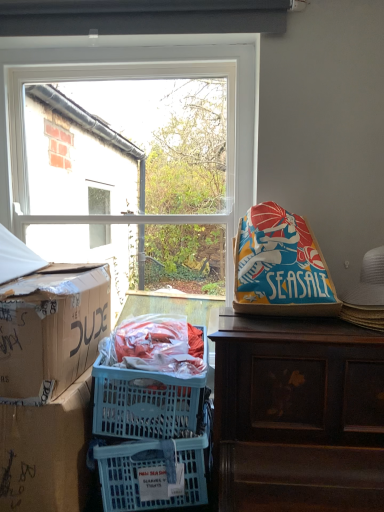
Question: From a real-world perspective, is cardboard box at left, acting as the 2th box starting from the top, physically above brown wooden desk at upper right?

Choices:
 (A) no
 (B) yes

Answer: (A)

Question: Is cardboard box at left, arranged as the 1th box when ordered from the bottom, looking in the opposite direction of brown wooden desk at upper right?

Choices:
 (A) no
 (B) yes

Answer: (A)

Question: Can you confirm if cardboard box at left, arranged as the 1th box when ordered from the bottom, is positioned to the right of brown wooden desk at upper right?

Choices:
 (A) yes
 (B) no

Answer: (B)

Question: From the image's perspective, is cardboard box at left, arranged as the 1th box when ordered from the bottom, over brown wooden desk at upper right?

Choices:
 (A) no
 (B) yes

Answer: (A)

Question: Are cardboard box at left, acting as the 2th box starting from the top, and brown wooden desk at upper right beside each other?

Choices:
 (A) yes
 (B) no

Answer: (B)

Question: Is the depth of cardboard box at left, arranged as the 1th box when ordered from the bottom, less than that of brown wooden desk at upper right?

Choices:
 (A) yes
 (B) no

Answer: (B)

Question: Can you confirm if blue fabric bean bag at right is taller than clear glass window at upper center?

Choices:
 (A) no
 (B) yes

Answer: (A)

Question: Does blue fabric bean bag at right come in front of clear glass window at upper center?

Choices:
 (A) yes
 (B) no

Answer: (A)

Question: Is blue fabric bean bag at right facing towards clear glass window at upper center?

Choices:
 (A) no
 (B) yes

Answer: (A)

Question: Is blue fabric bean bag at right positioned behind clear glass window at upper center?

Choices:
 (A) no
 (B) yes

Answer: (A)

Question: Is blue fabric bean bag at right outside clear glass window at upper center?

Choices:
 (A) yes
 (B) no

Answer: (A)

Question: From a real-world perspective, is blue fabric bean bag at right located higher than clear glass window at upper center?

Choices:
 (A) yes
 (B) no

Answer: (B)

Question: From the image's perspective, is brown wooden desk at upper right above clear glass window at upper center?

Choices:
 (A) yes
 (B) no

Answer: (B)